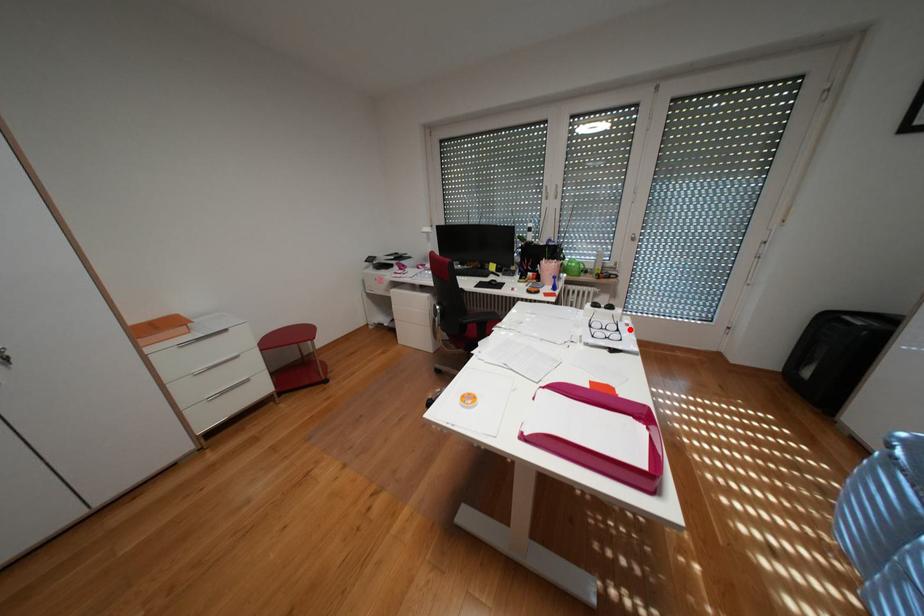
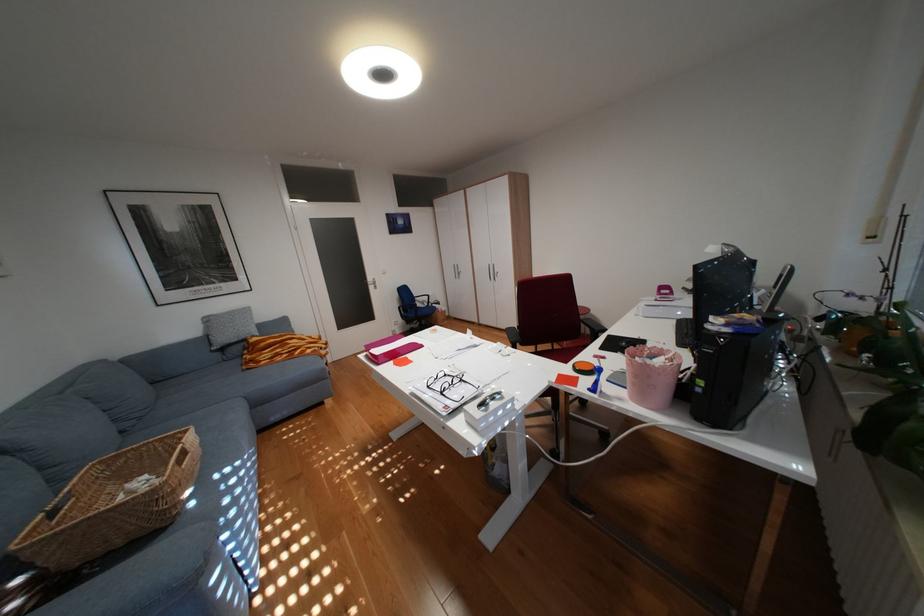
Find the pixel in the second image that matches the highlighted location in the first image.

(454, 392)